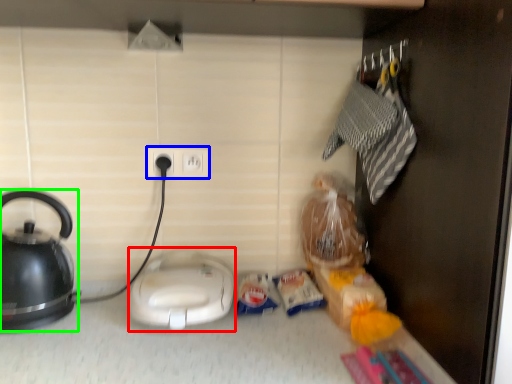
Question: Which is nearer to the appliance (highlighted by a red box)? power plugs and sockets (highlighted by a blue box) or kettle (highlighted by a green box).

Choices:
 (A) power plugs and sockets
 (B) kettle

Answer: (B)